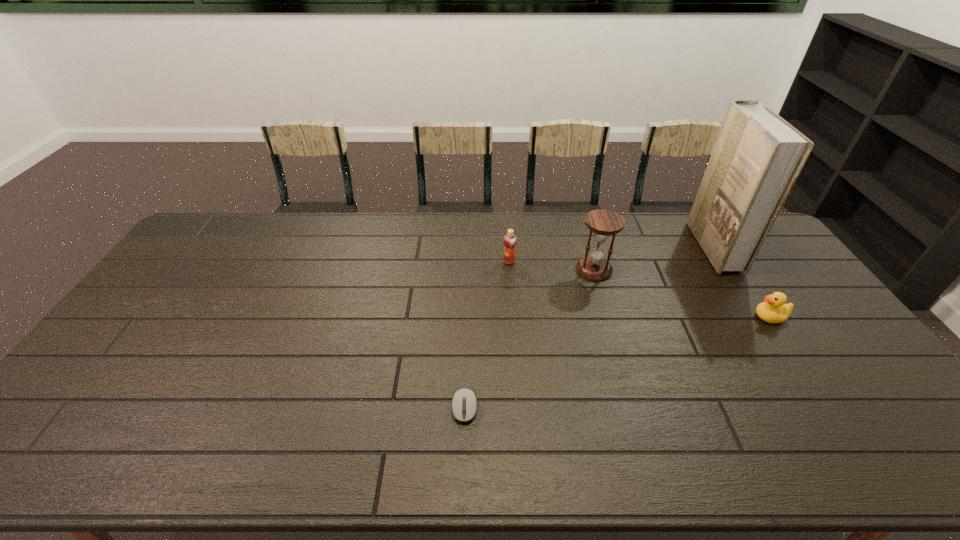
Find the location of a particular element. This screenshot has height=540, width=960. duck that is at the right edge is located at coordinates (774, 310).

Image resolution: width=960 pixels, height=540 pixels. Identify the location of object at the far right corner. (757, 157).

You are a GUI agent. You are given a task and a screenshot of the screen. Output one action in this format:
    pyautogui.click(x=<x>, y=<y>)
    Task: Click on the free space at the far edge of the desktop
    The width and height of the screenshot is (960, 540).
    Given the screenshot: What is the action you would take?
    pyautogui.click(x=424, y=215)

In the image, there is a desktop. Find the location of `free space at the near edge`. free space at the near edge is located at coordinates (305, 443).

Locate an element on the screen. vacant region at the left edge of the desktop is located at coordinates (167, 339).

The height and width of the screenshot is (540, 960). Identify the location of vacant space at the right edge. (832, 339).

What are the coordinates of `free point between the leftmost object and the third object from right to left` in the screenshot? It's located at (529, 338).

You are a GUI agent. You are given a task and a screenshot of the screen. Output one action in this format:
    pyautogui.click(x=<x>, y=<y>)
    Task: Click on the unoccupied area between the leftmost object and the second object from left to right
    This screenshot has width=960, height=540.
    Given the screenshot: What is the action you would take?
    pyautogui.click(x=487, y=334)

This screenshot has width=960, height=540. Identify the location of blank region between the second object from left to right and the second nearest object. (639, 289).

This screenshot has width=960, height=540. Find the location of `free space between the second tallest object and the tallest object`. free space between the second tallest object and the tallest object is located at coordinates (654, 258).